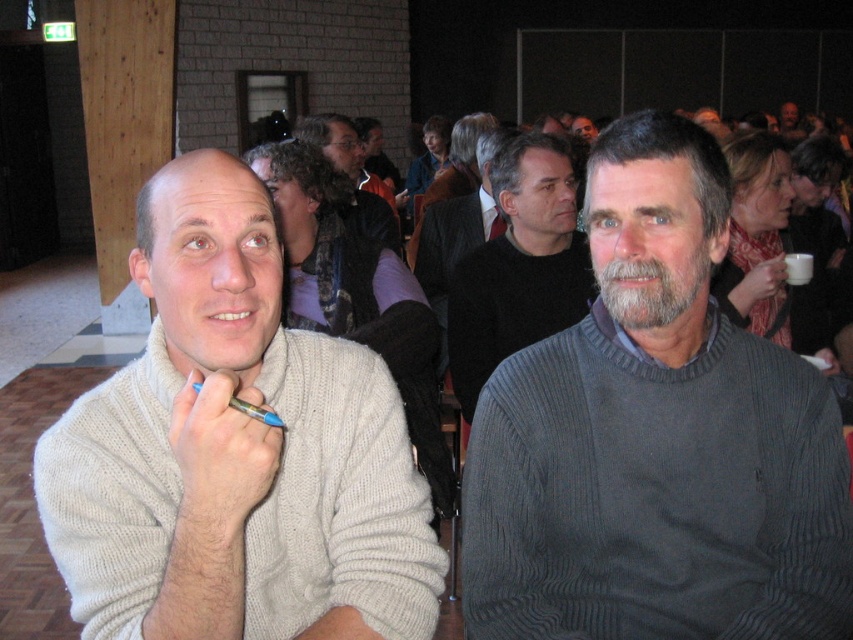
You are standing in the conference hall and need to locate the dark gray ribbed sweater at center. According to the coordinates provided, where exactly is it positioned in the image?

The dark gray ribbed sweater at center is positioned at coordinates point (656, 438).